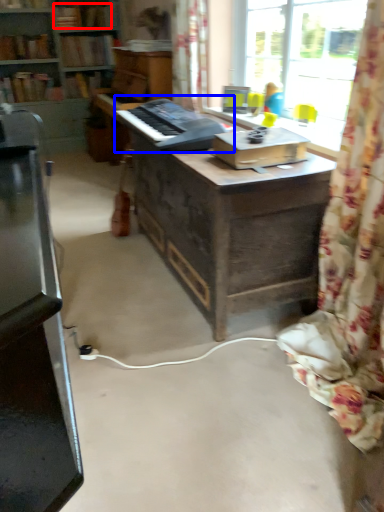
Question: Which of the following is the closest to the observer, book (highlighted by a red box) or musical keyboard (highlighted by a blue box)?

Choices:
 (A) book
 (B) musical keyboard

Answer: (B)